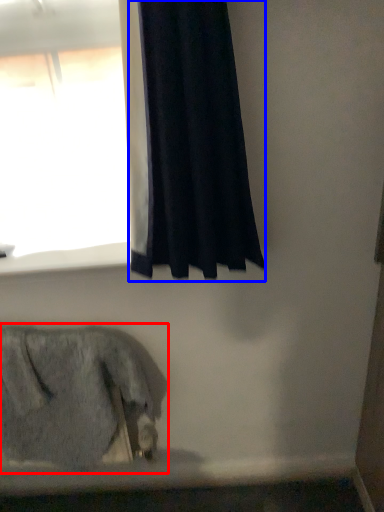
Question: Which object appears farthest to the camera in this image, animal (highlighted by a red box) or curtain (highlighted by a blue box)?

Choices:
 (A) animal
 (B) curtain

Answer: (A)